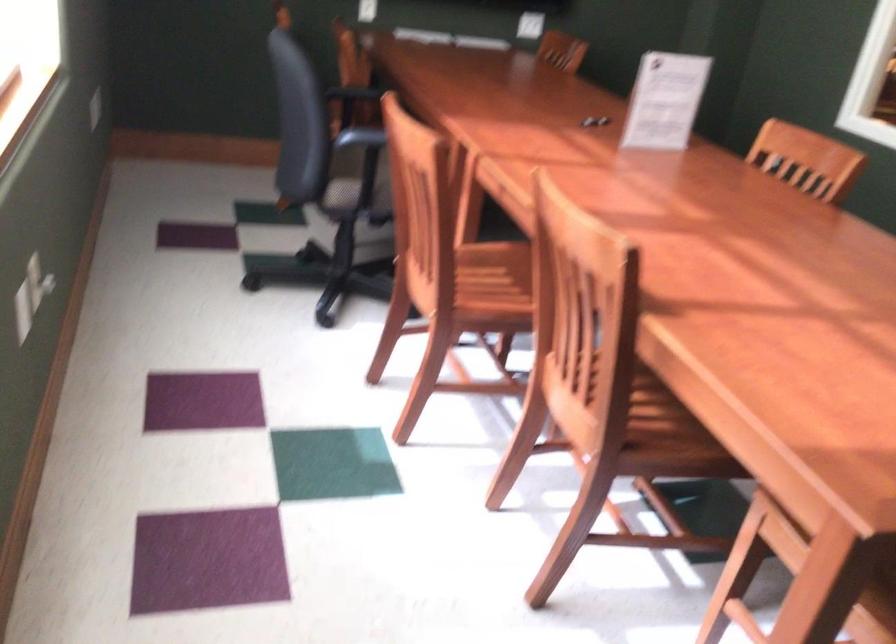
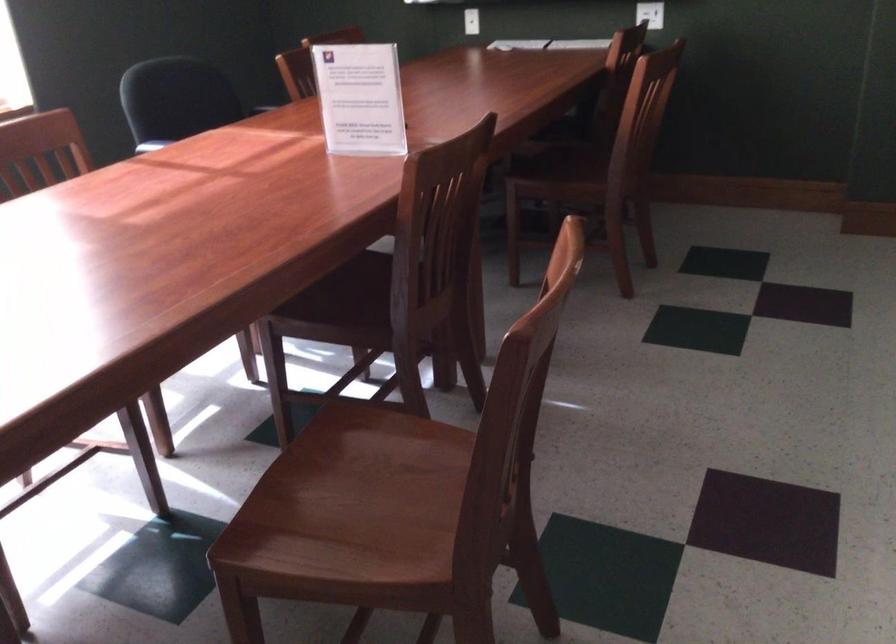
Locate, in the second image, the point that corresponds to pixel 658 95 in the first image.

(359, 98)